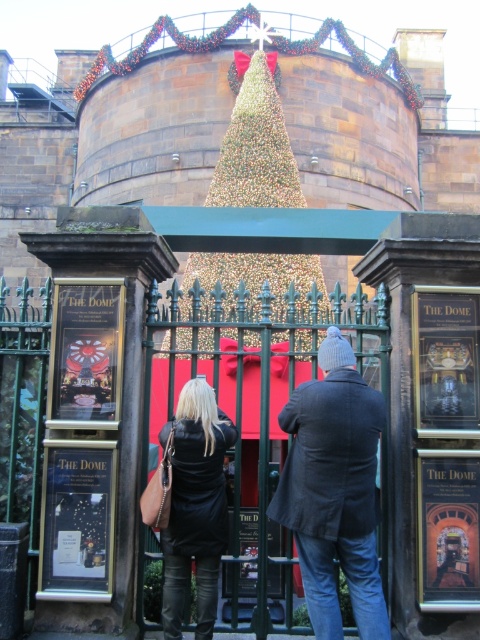
You are standing behind the closed green metal gate in the festive scene. There are two points marked in the image. The first point is at coordinates point (307,406) and the second point is at point (212,589). Which of these points is closer to you?

Point (307,406) is in front of point (212,589), so the first point is closer to you.